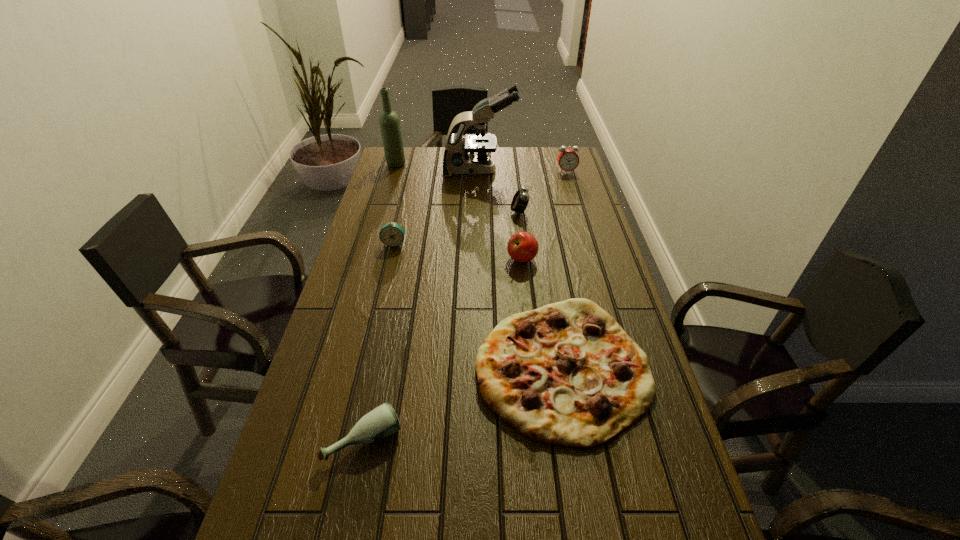
At what (x,y) coordinates should I click in order to perform the action: click on microscope. Please return your answer as a coordinate pair (x, y). This screenshot has width=960, height=540. Looking at the image, I should click on (456, 160).

At what (x,y) coordinates should I click in order to perform the action: click on wine bottle. Please return your answer as a coordinate pair (x, y). Looking at the image, I should click on (389, 122).

Locate an element on the screen. This screenshot has height=540, width=960. the rightmost alarm clock is located at coordinates (568, 160).

Identify the location of the second alarm clock from left to right. (520, 200).

Image resolution: width=960 pixels, height=540 pixels. I want to click on the second farthest alarm clock, so [520, 200].

This screenshot has height=540, width=960. What are the coordinates of `apple` in the screenshot? It's located at (522, 246).

Identify the location of the nearest alarm clock. (392, 234).

Locate an element on the screen. the shortest alarm clock is located at coordinates (392, 234).

The width and height of the screenshot is (960, 540). Find the location of `the seventh tallest object`. the seventh tallest object is located at coordinates (381, 422).

This screenshot has width=960, height=540. I want to click on the shortest object, so click(x=566, y=374).